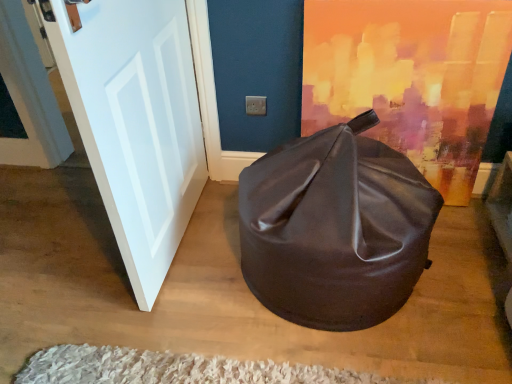
Where is `free space behind white shaggy rug at lower center`? Image resolution: width=512 pixels, height=384 pixels. free space behind white shaggy rug at lower center is located at coordinates (211, 297).